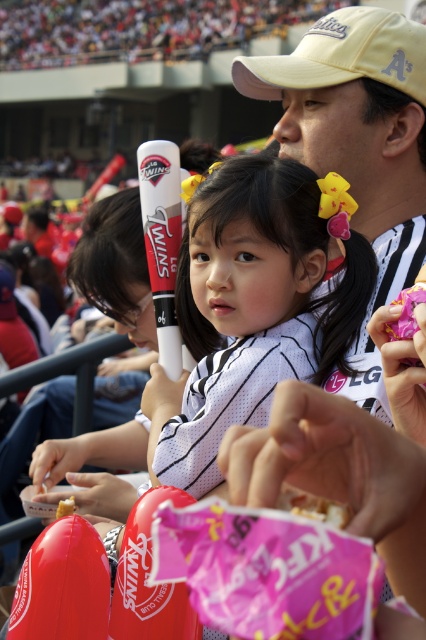
Question: Which point is closer to the camera taking this photo?

Choices:
 (A) (356, 337)
 (B) (63, 513)
 (C) (189, 209)
 (D) (152, 186)

Answer: (B)

Question: Does white matte baseball bat at center appear on the right side of red matte baseball bat at center?

Choices:
 (A) no
 (B) yes

Answer: (B)

Question: Which of the following is the farthest from the observer?

Choices:
 (A) (319, 100)
 (B) (62, 515)
 (C) (164, 200)

Answer: (A)

Question: From the image, what is the correct spatial relationship of white matte baseball bat at center in relation to yellow fabric baseball cap at upper center?

Choices:
 (A) left
 (B) right

Answer: (A)

Question: Is yellow fabric baseball cap at upper center below yellow sponge cake at center?

Choices:
 (A) yes
 (B) no

Answer: (B)

Question: Which of these objects is positioned farthest from the white matte baseball bat at center?

Choices:
 (A) red matte baseball bat at center
 (B) yellow sponge cake at center

Answer: (B)